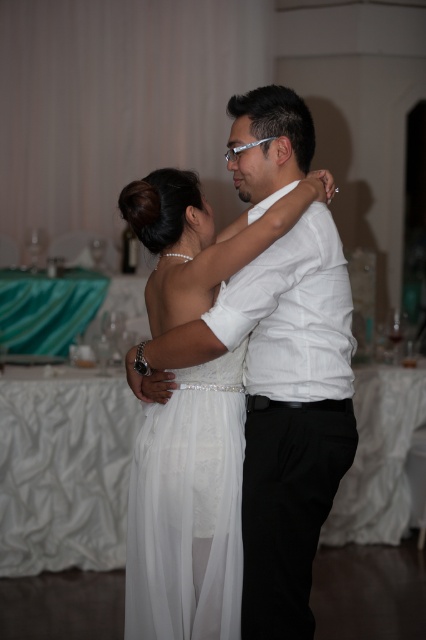
What is located at the point with coordinates (187,512) in the image?

The point with coordinates (187,512) is located on the white satin dress at center.

Based on the scene description, which dress has a greater width between the white satin dress at center and the white sheer dress at center?

The white satin dress at center has a greater width than the white sheer dress at center according to the description.